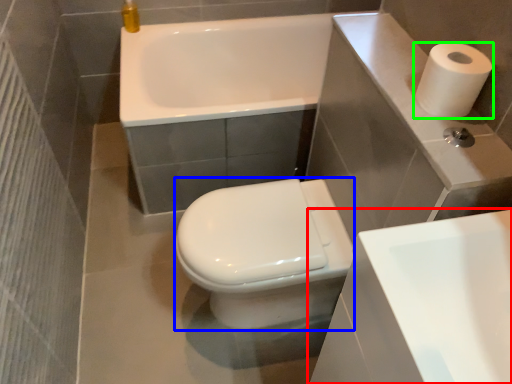
Question: Which object is positioned farthest from sink (highlighted by a red box)? Select from bidet (highlighted by a blue box) and paper towel (highlighted by a green box).

Choices:
 (A) bidet
 (B) paper towel

Answer: (A)